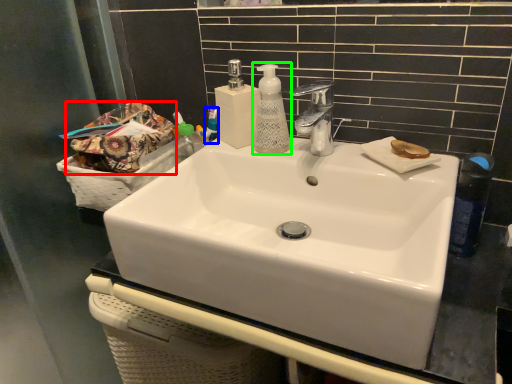
Question: Based on their relative distances, which object is nearer to material (highlighted by a red box)? Choose from mouthwash (highlighted by a blue box) and soap dispenser (highlighted by a green box).

Choices:
 (A) mouthwash
 (B) soap dispenser

Answer: (A)